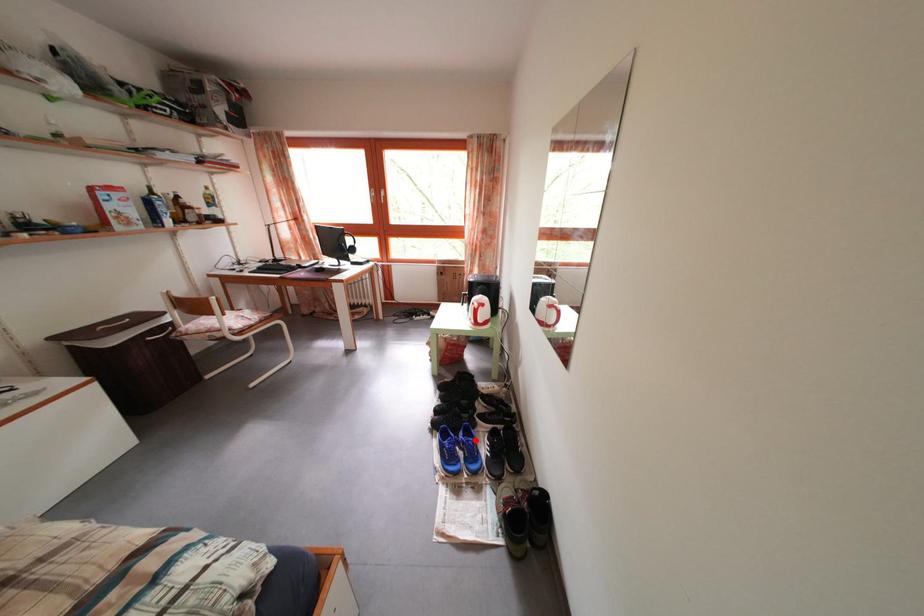
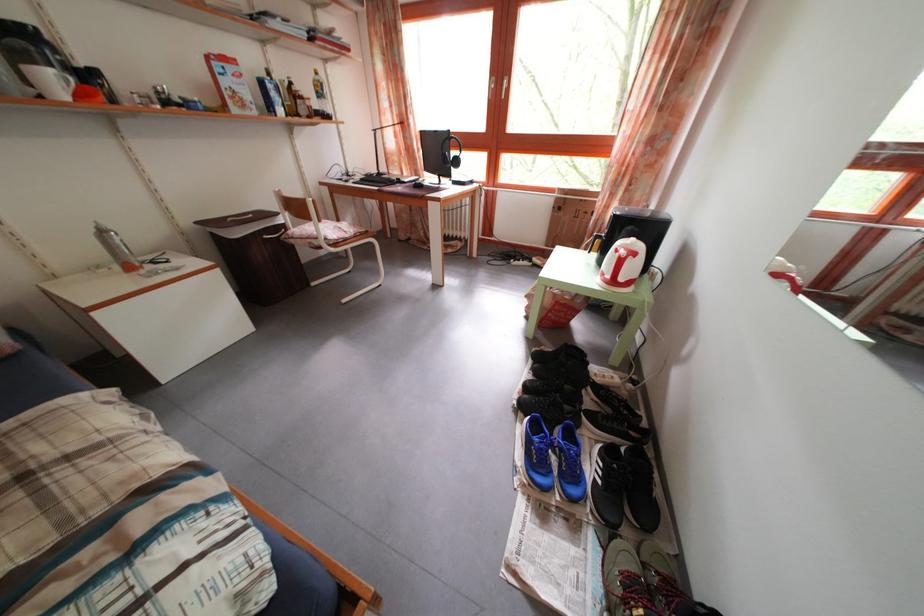
Question: A red point is marked in image1. In image2, is the corresponding 3D point closer to the camera or farther? Reply with the corresponding letter.

Choices:
 (A) The corresponding 3D point is closer.
 (B) The corresponding 3D point is farther.

Answer: (A)